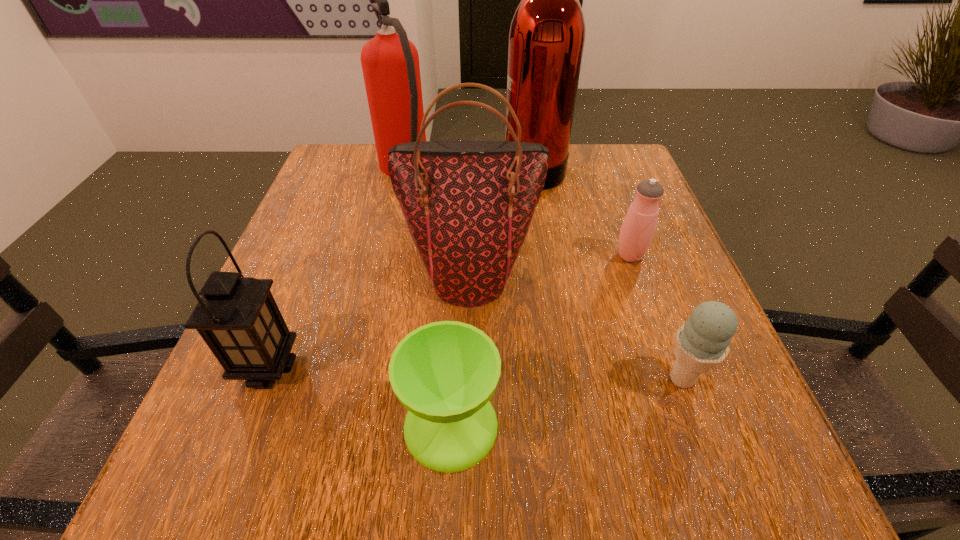
Where is `blank space located on the front-facing side of the right fire extinguisher`? The image size is (960, 540). blank space located on the front-facing side of the right fire extinguisher is located at coordinates (424, 166).

This screenshot has height=540, width=960. What are the coordinates of `vacant space located 0.070m on the front-facing side of the right fire extinguisher` in the screenshot? It's located at (474, 166).

At what (x,y) coordinates should I click in order to perform the action: click on free space located on the left of the handbag. Please return your answer as a coordinate pair (x, y). The image size is (960, 540). Looking at the image, I should click on (287, 276).

At what (x,y) coordinates should I click in order to perform the action: click on vacant region located 0.180m on the right of the fourth tallest object. Please return your answer as a coordinate pair (x, y). The height and width of the screenshot is (540, 960). Looking at the image, I should click on (409, 367).

Find the location of a particular element. The height and width of the screenshot is (540, 960). vacant space located 0.130m on the back of the thermos bottle is located at coordinates (613, 208).

Image resolution: width=960 pixels, height=540 pixels. What are the coordinates of `vacant space located on the back of the ice cream` in the screenshot? It's located at (631, 240).

This screenshot has height=540, width=960. I want to click on free spot located 0.210m on the left of the wineglass, so click(x=258, y=425).

The width and height of the screenshot is (960, 540). Identify the location of object located in the near edge section of the desktop. (444, 373).

This screenshot has height=540, width=960. I want to click on fire extinguisher present at the left edge, so click(x=390, y=62).

This screenshot has height=540, width=960. I want to click on lantern present at the left edge, so click(x=237, y=317).